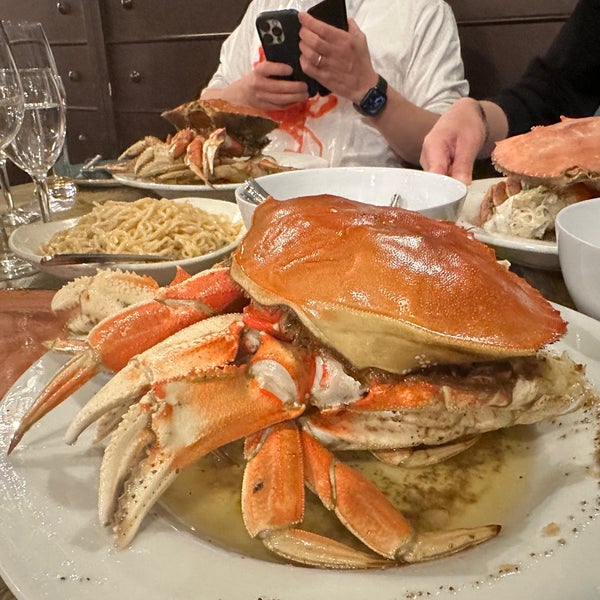
Where is `white plate`? The image size is (600, 600). white plate is located at coordinates (199, 585).